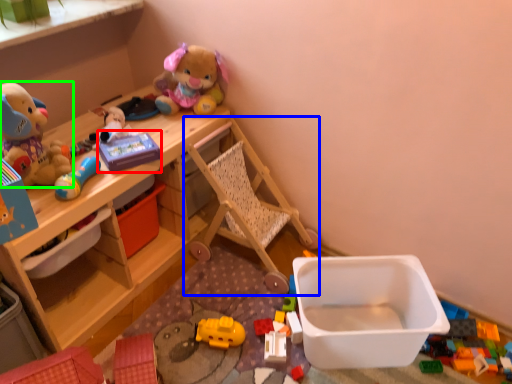
Question: Which object is positioned closest to toy (highlighted by a red box)? Select from baby carriage (highlighted by a blue box) and toy (highlighted by a green box).

Choices:
 (A) baby carriage
 (B) toy

Answer: (B)